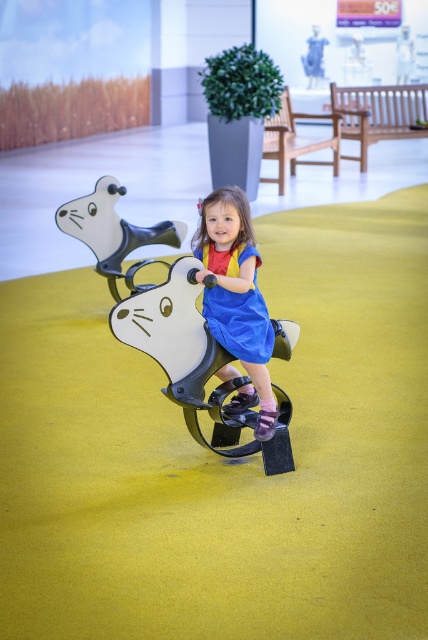
Question: Among these objects, which one is nearest to the camera?

Choices:
 (A) metallic silver bear at center
 (B) blue cotton dress at center

Answer: (B)

Question: Is blue cotton dress at center further to the viewer compared to metallic silver bear at center?

Choices:
 (A) yes
 (B) no

Answer: (B)

Question: Is blue cotton dress at center positioned before metallic silver bear at center?

Choices:
 (A) no
 (B) yes

Answer: (B)

Question: Does blue cotton dress at center appear on the left side of metallic silver bear at center?

Choices:
 (A) no
 (B) yes

Answer: (A)

Question: Considering the real-world distances, which object is closest to the blue cotton dress at center?

Choices:
 (A) metallic silver bear at center
 (B) blue satin dress at center

Answer: (B)

Question: Based on their relative distances, which object is nearer to the blue cotton dress at center?

Choices:
 (A) metallic silver bear at center
 (B) blue satin dress at center

Answer: (B)